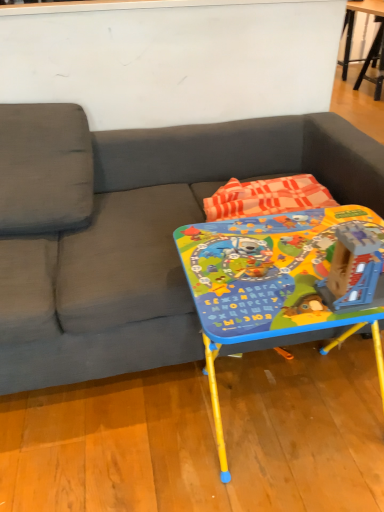
Where is `empty space that is in between matte plastic table at center, which is the second table in back-to-front order, and gray fabric couch at center`? This screenshot has width=384, height=512. empty space that is in between matte plastic table at center, which is the second table in back-to-front order, and gray fabric couch at center is located at coordinates (148, 428).